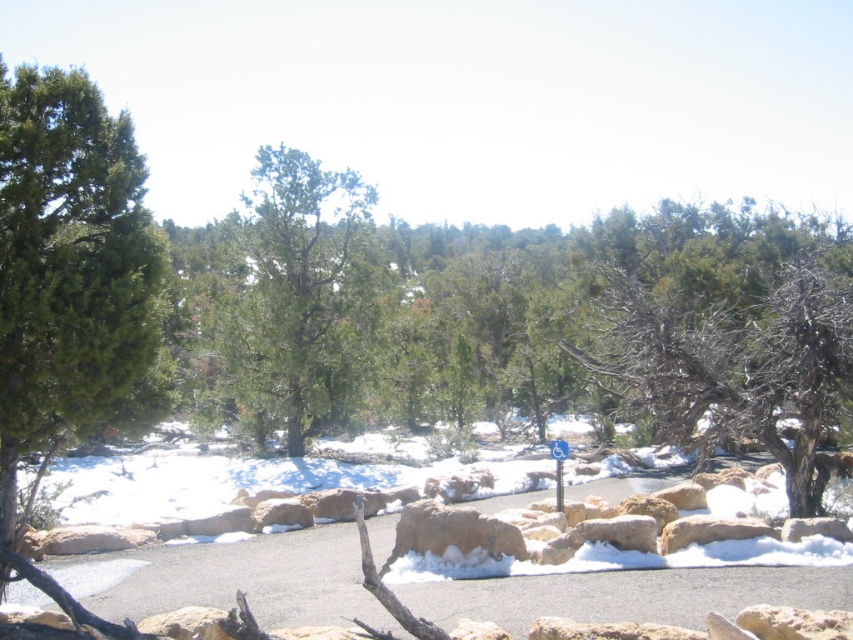
You are a hiker trying to navigate through the snow. You see the green matte tree at left and the blue plastic sign at center. Which object would you estimate is closer to you based on their sizes?

The green matte tree at left is larger in size than the blue plastic sign at center, so it is closer to you since larger objects in the foreground appear bigger than distant ones.

You are a hiker trying to navigate through the snowy path. You notice a green matte tree at center and a blue plastic sign at center. Which object is larger in size?

The green matte tree at center is bigger than the blue plastic sign at center.